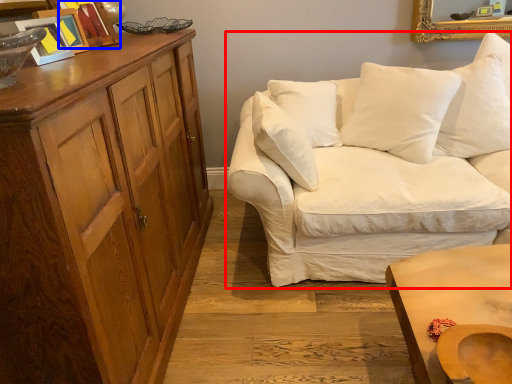
Question: Which object is further to the camera taking this photo, studio couch (highlighted by a red box) or picture frame (highlighted by a blue box)?

Choices:
 (A) studio couch
 (B) picture frame

Answer: (B)